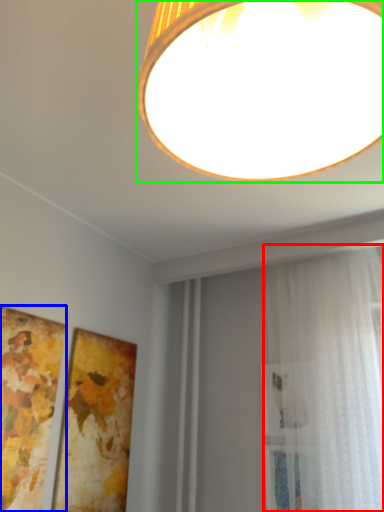
Question: Which object is positioned closest to curtain (highlighted by a red box)? Select from picture frame (highlighted by a blue box) and lamp (highlighted by a green box).

Choices:
 (A) picture frame
 (B) lamp

Answer: (A)